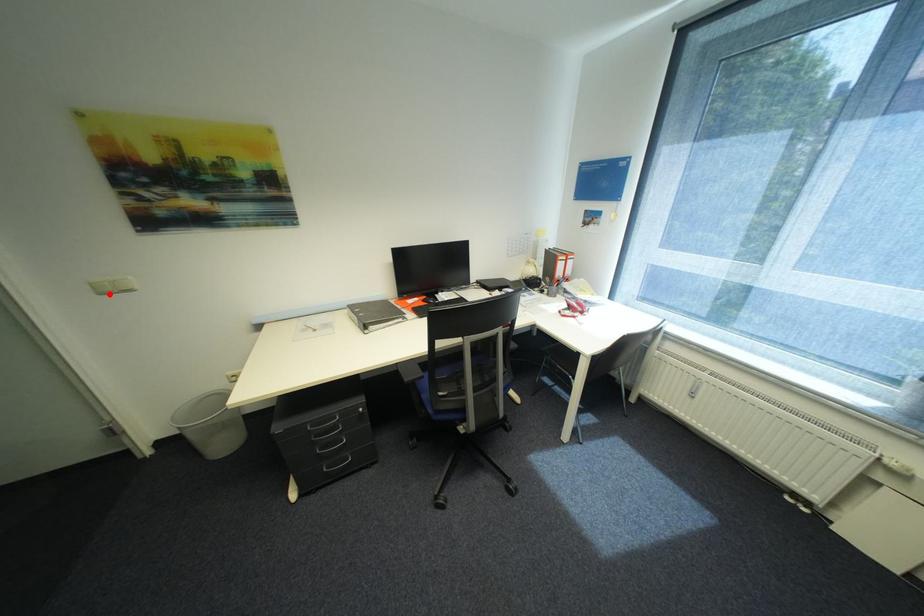
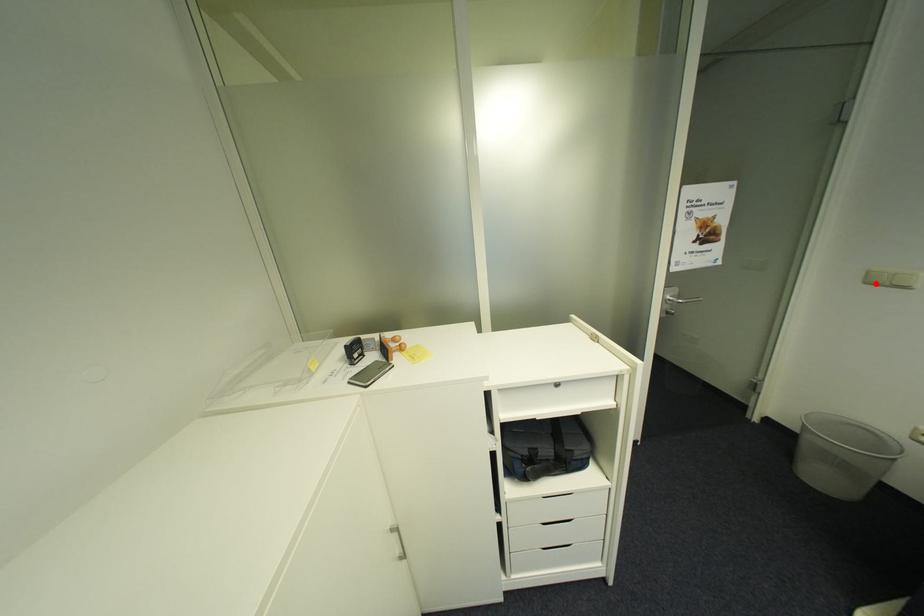
I am providing you with two images of the same scene from different viewpoints. A red point is marked on the first image and another point is marked on the second image. Do the highlighted points in image1 and image2 indicate the same real-world spot?

Yes